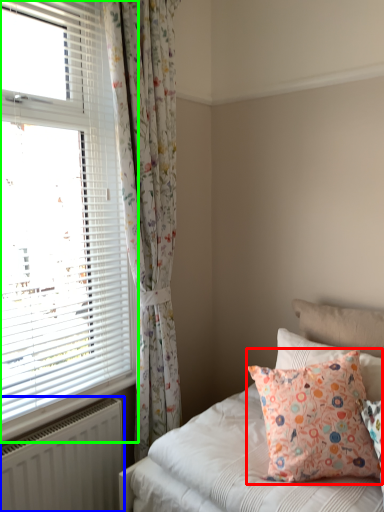
Question: Based on their relative distances, which object is nearer to pillow (highlighted by a red box)? Choose from radiator (highlighted by a blue box) and window (highlighted by a green box).

Choices:
 (A) radiator
 (B) window

Answer: (A)